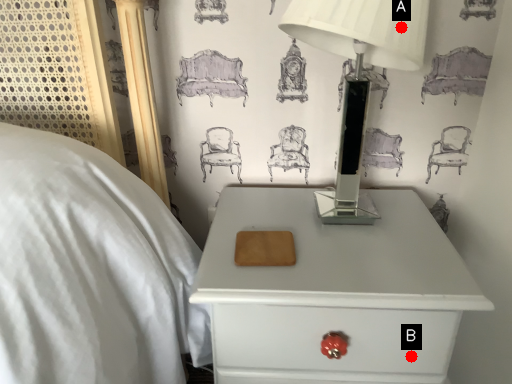
Question: Two points are circled on the image, labeled by A and B beside each circle. Which of the following is the closest to the observer?

Choices:
 (A) A is closer
 (B) B is closer

Answer: (A)